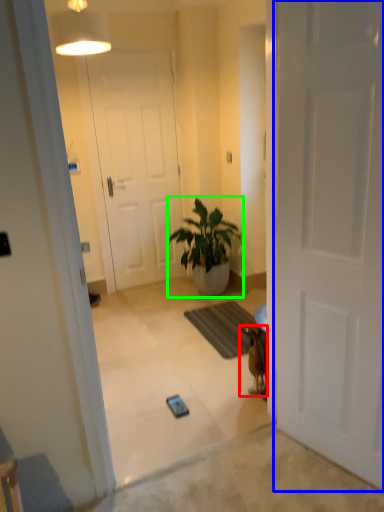
Question: Which is farther away from animal (highlighted by a red box)? door (highlighted by a blue box) or houseplant (highlighted by a green box)?

Choices:
 (A) door
 (B) houseplant

Answer: (B)